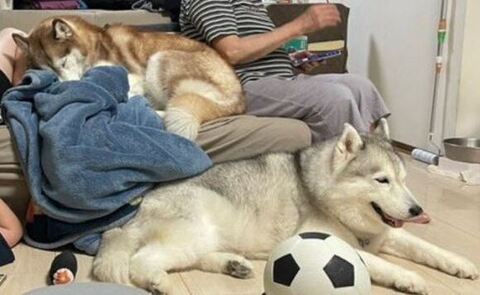
You are a GUI agent. You are given a task and a screenshot of the screen. Output one action in this format:
    pyautogui.click(x=<x>, y=<y>)
    Task: Click on the tile
    
    Given the screenshot: What is the action you would take?
    pyautogui.click(x=214, y=292)